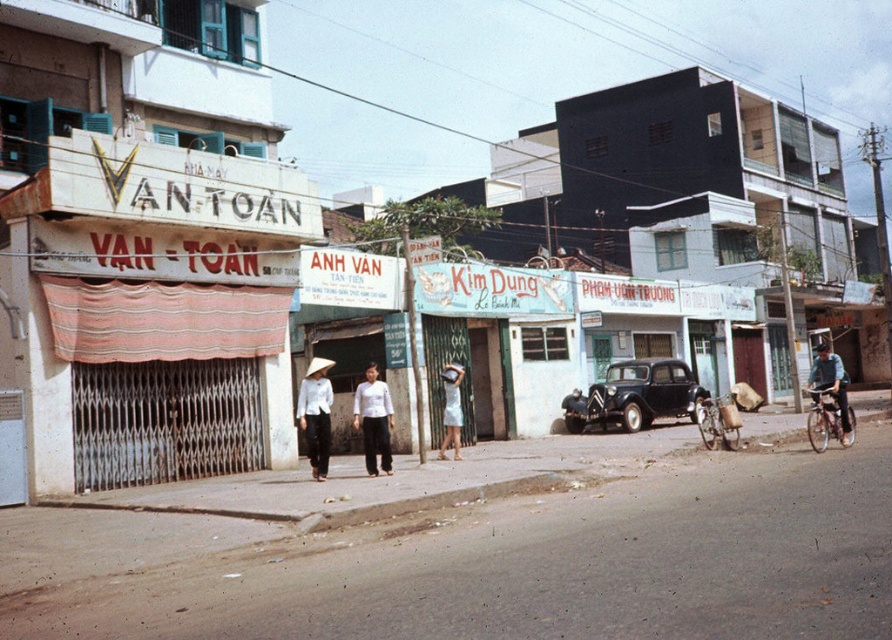
How much distance is there between matte black car at center-right and white satin dress at center?

matte black car at center-right is 23.23 feet away from white satin dress at center.

How distant is matte black car at center-right from white satin dress at center?

They are 7.08 meters apart.

Which is behind, point (639, 426) or point (453, 372)?

Point (639, 426)

At what (x,y) coordinates should I click in order to perform the action: click on matte black car at center-right. Please return your answer as a coordinate pair (x, y). The height and width of the screenshot is (640, 892). Looking at the image, I should click on (636, 396).

Which is more to the right, shiny metallic bicycle at right or white satin dress at center?

From the viewer's perspective, shiny metallic bicycle at right appears more on the right side.

Is shiny metallic bicycle at right above white satin dress at center?

Actually, shiny metallic bicycle at right is below white satin dress at center.

The width and height of the screenshot is (892, 640). What do you see at coordinates (827, 419) in the screenshot?
I see `shiny metallic bicycle at right` at bounding box center [827, 419].

This screenshot has width=892, height=640. What are the coordinates of `shiny metallic bicycle at right` in the screenshot? It's located at (827, 419).

From the picture: Who is lower down, shiny metallic bicycle at right or light blue denim jacket at right?

shiny metallic bicycle at right is below.

Does point (820, 424) come in front of point (826, 346)?

Yes, it is.

What are the coordinates of `shiny metallic bicycle at right` in the screenshot? It's located at (827, 419).